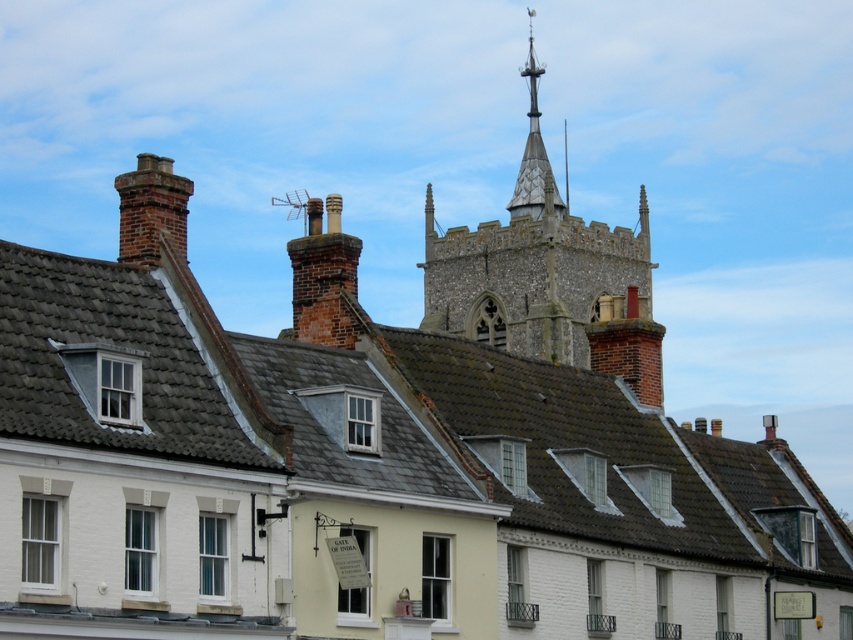
Question: Among these objects, which one is nearest to the camera?

Choices:
 (A) brick chimney at center
 (B) brick chimney at left

Answer: (B)

Question: Which point is farther to the camera?

Choices:
 (A) (136, 246)
 (B) (355, 268)

Answer: (B)

Question: Is stone steeple at upper center below brick chimney at center?

Choices:
 (A) no
 (B) yes

Answer: (A)

Question: Which is nearer to the brick chimney at left?

Choices:
 (A) stone steeple at upper center
 (B) brick chimney at center

Answer: (B)

Question: Observing the image, what is the correct spatial positioning of stone steeple at upper center in reference to brick chimney at center?

Choices:
 (A) below
 (B) above

Answer: (B)

Question: Considering the relative positions of stone steeple at upper center and brick chimney at center in the image provided, where is stone steeple at upper center located with respect to brick chimney at center?

Choices:
 (A) left
 (B) right

Answer: (B)